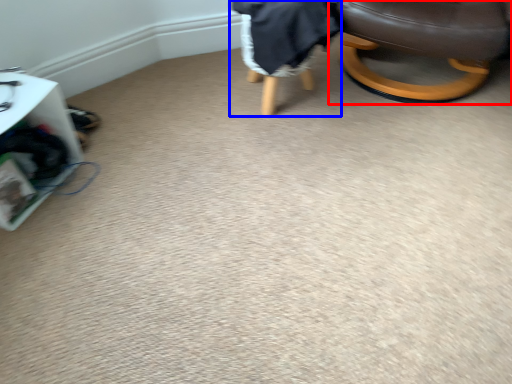
Question: Which of the following is the closest to the observer, chair (highlighted by a red box) or bean bag chair (highlighted by a blue box)?

Choices:
 (A) chair
 (B) bean bag chair

Answer: (A)